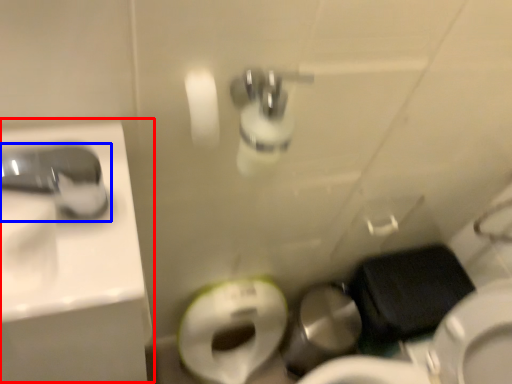
Question: Which point is closer to the camera, sink (highlighted by a red box) or tap (highlighted by a blue box)?

Choices:
 (A) sink
 (B) tap

Answer: (B)